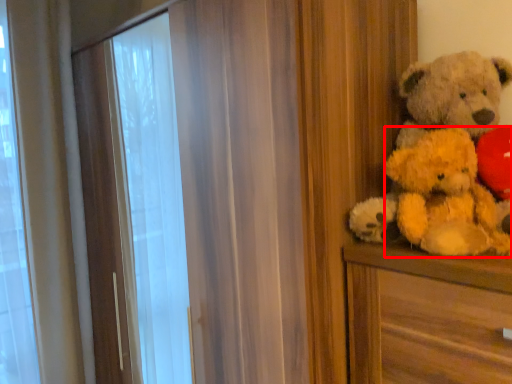
Question: In this image, where is teddy (annotated by the red box) located relative to teddy bear?

Choices:
 (A) left
 (B) right

Answer: (A)